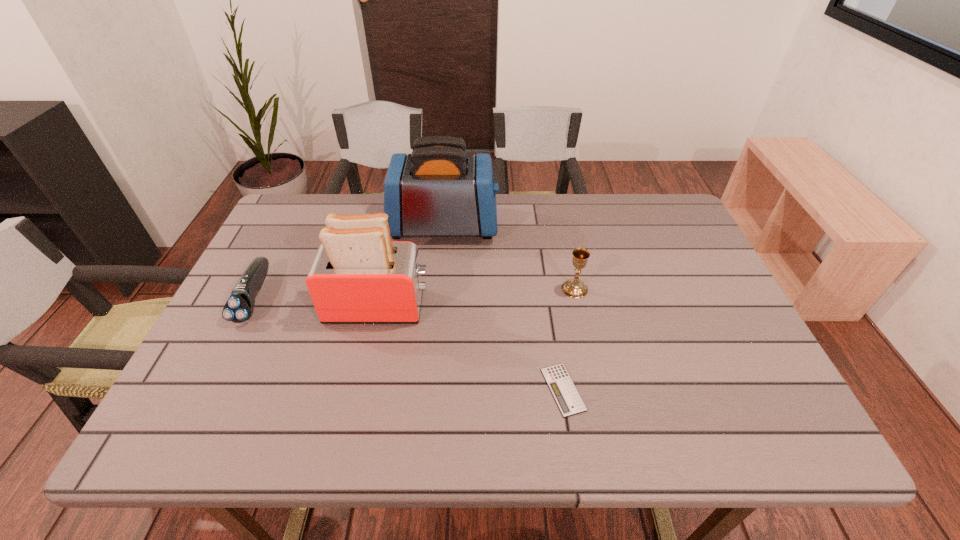
Find the location of `vacant space situated on the head of the electric shaver`. vacant space situated on the head of the electric shaver is located at coordinates (188, 429).

Locate an element on the screen. blank space located on the right of the nearest object is located at coordinates (631, 389).

The image size is (960, 540). In order to click on object positioned at the far edge in this screenshot , I will do `click(439, 190)`.

Locate an element on the screen. The width and height of the screenshot is (960, 540). object located in the near edge section of the desktop is located at coordinates (565, 394).

You are a GUI agent. You are given a task and a screenshot of the screen. Output one action in this format:
    pyautogui.click(x=<x>, y=<y>)
    Task: Click on the object that is positioned at the left edge
    The height and width of the screenshot is (540, 960).
    Given the screenshot: What is the action you would take?
    pyautogui.click(x=239, y=307)

You are a GUI agent. You are given a task and a screenshot of the screen. Output one action in this format:
    pyautogui.click(x=<x>, y=<y>)
    Task: Click on the vacant space at the far edge
    The height and width of the screenshot is (540, 960).
    Given the screenshot: What is the action you would take?
    pyautogui.click(x=626, y=219)

Find the location of `vacant space at the near edge of the desktop`. vacant space at the near edge of the desktop is located at coordinates (467, 406).

I want to click on free space at the left edge, so click(265, 242).

This screenshot has height=540, width=960. In order to click on free space at the right edge of the desktop in this screenshot , I will do `click(756, 404)`.

I want to click on vacant space at the far left corner of the desktop, so click(294, 218).